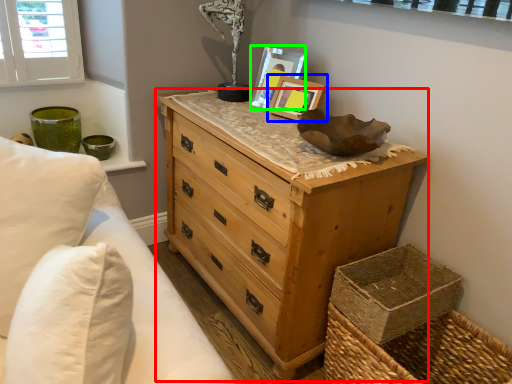
Question: Based on their relative distances, which object is farther from chest of drawers (highlighted by a red box)? Choose from picture frame (highlighted by a blue box) and picture frame (highlighted by a green box).

Choices:
 (A) picture frame
 (B) picture frame

Answer: (B)